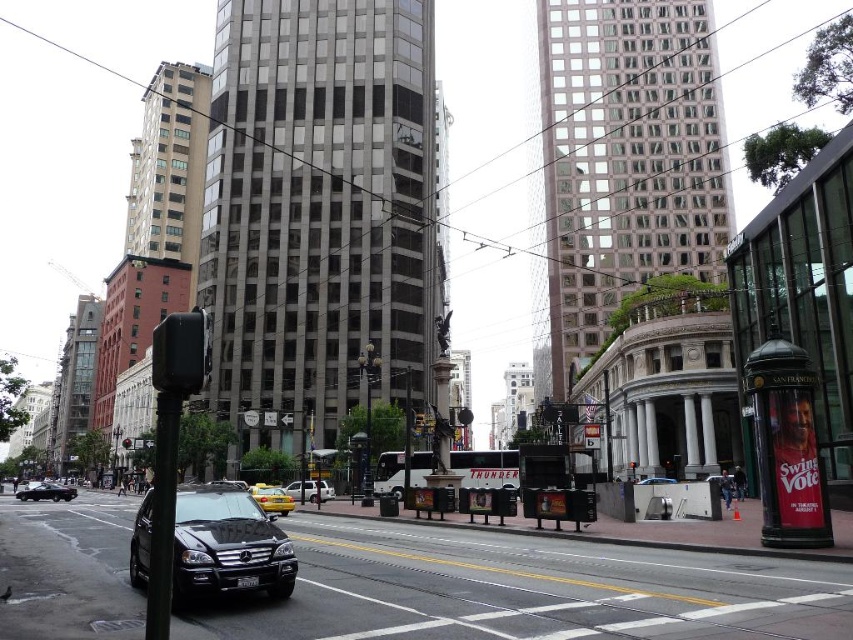
You are a pedestrian standing at the crosswalk near the shiny black sedan at lower left. You want to cross the street to reach the bus stop located near the metallic traffic light at upper center. The crosswalk is 18 meters long. Can you safely cross the crosswalk before the traffic light turns red?

The distance between the shiny black sedan at lower left and the metallic traffic light at upper center is 18.53 meters. Since the crosswalk is 18 meters long, you can safely cross the crosswalk before the traffic light turns red as the distance is sufficient.

You are a pedestrian standing on the sidewalk and want to cross the street where the shiny black suv at center is driving. The metallic traffic light at upper center is your reference point. Which object is nearer to you as you prepare to cross?

The shiny black suv at center is closer to you than the metallic traffic light at upper center, so you should be cautious of the SUV first.

Looking at this image, you are a pedestrian standing at the intersection and want to cross the street. You see a shiny black sedan at lower left and a metallic traffic light at upper center. Which object is taller?

The metallic traffic light at upper center is taller than the shiny black sedan at lower left.